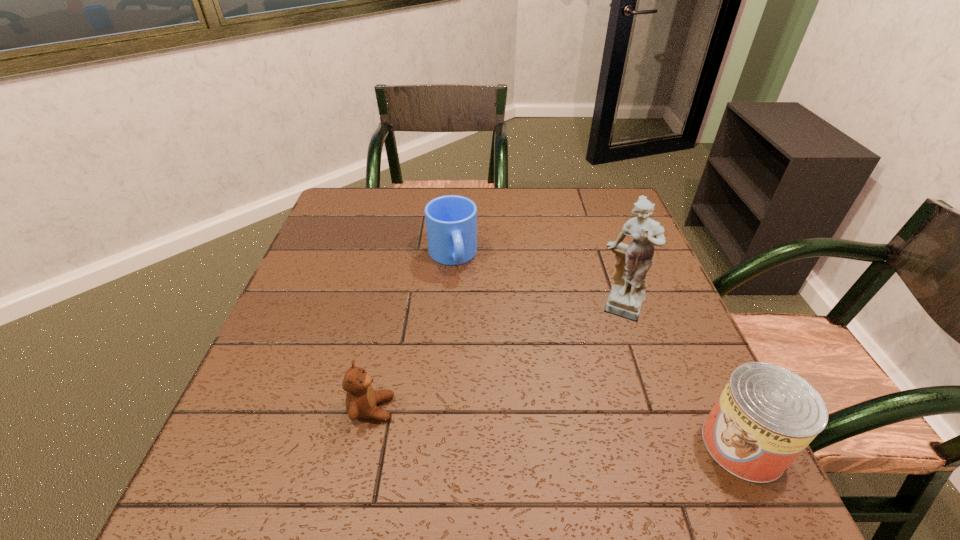
Identify the location of free space at the near edge of the desktop. Image resolution: width=960 pixels, height=540 pixels. (554, 442).

In the image, there is a desktop. Where is `free space at the left edge`? free space at the left edge is located at coordinates (334, 360).

In the image, there is a desktop. Identify the location of vacant space at the right edge. (657, 284).

This screenshot has width=960, height=540. I want to click on free space at the far left corner of the desktop, so click(380, 195).

Locate an element on the screen. This screenshot has width=960, height=540. free space at the far right corner is located at coordinates (612, 202).

At what (x,y) coordinates should I click in order to perform the action: click on vacant space that is in between the mug and the teddy bear. Please return your answer as a coordinate pair (x, y). The height and width of the screenshot is (540, 960). Looking at the image, I should click on (412, 332).

The image size is (960, 540). In order to click on free space between the teddy bear and the farthest object in this screenshot , I will do `click(412, 332)`.

The height and width of the screenshot is (540, 960). I want to click on free space between the second object from left to right and the rightmost object, so click(x=597, y=350).

The width and height of the screenshot is (960, 540). I want to click on free area in between the farthest object and the leftmost object, so click(x=412, y=332).

This screenshot has height=540, width=960. What are the coordinates of `blank region between the tallest object and the leftmost object` in the screenshot? It's located at (497, 359).